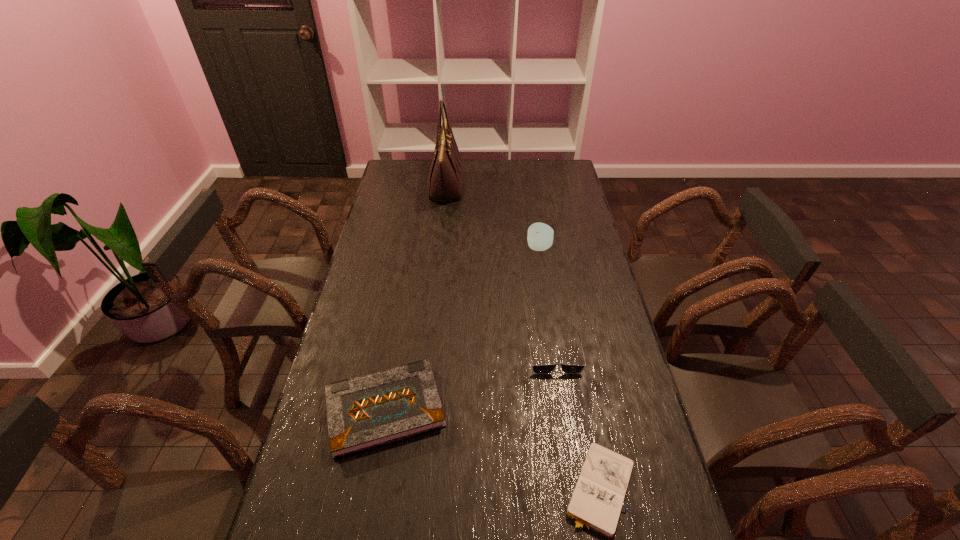
The image size is (960, 540). Identify the location of the tallest object. point(445,179).

The width and height of the screenshot is (960, 540). Find the location of `the farthest object`. the farthest object is located at coordinates (445, 179).

This screenshot has width=960, height=540. I want to click on apple, so click(540, 236).

Find the location of a particular element. The image size is (960, 540). the second tallest object is located at coordinates (540, 236).

Image resolution: width=960 pixels, height=540 pixels. In order to click on sunglasses in this screenshot , I will do `click(538, 369)`.

Locate an element on the screen. the left notebook is located at coordinates (365, 412).

The height and width of the screenshot is (540, 960). Find the location of `the shorter notebook`. the shorter notebook is located at coordinates (596, 502).

Image resolution: width=960 pixels, height=540 pixels. Find the location of `the right notebook`. the right notebook is located at coordinates (596, 502).

This screenshot has width=960, height=540. I want to click on vacant space located on the front-facing side of the farthest object, so click(512, 187).

Locate an element on the screen. This screenshot has height=540, width=960. free region located on the left of the apple is located at coordinates (454, 248).